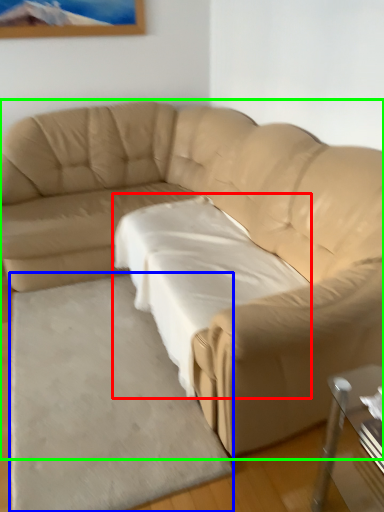
Question: Estimate the real-world distances between objects in this image. Which object is closer to sheet (highlighted by a red box), mat (highlighted by a blue box) or studio couch (highlighted by a green box)?

Choices:
 (A) mat
 (B) studio couch

Answer: (B)